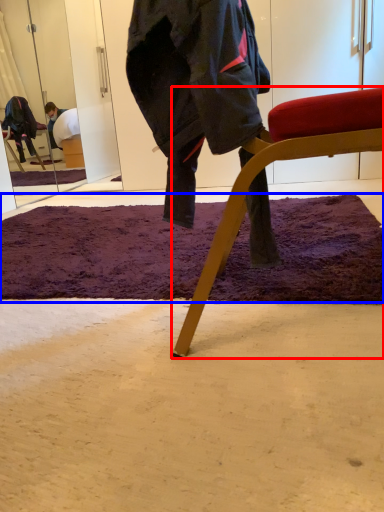
Question: Which point is closer to the camera, chair (highlighted by a red box) or mat (highlighted by a blue box)?

Choices:
 (A) chair
 (B) mat

Answer: (A)